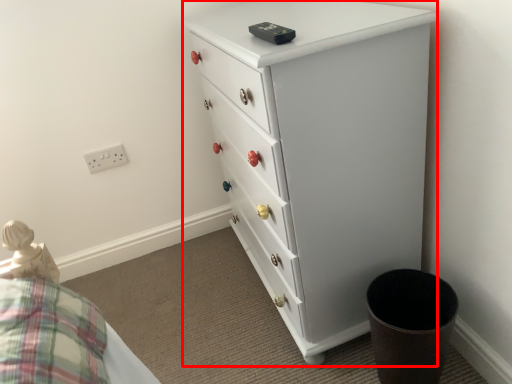
Question: In this image, where is chest of drawers (annotated by the red box) located relative to electric outlet?

Choices:
 (A) left
 (B) right

Answer: (B)